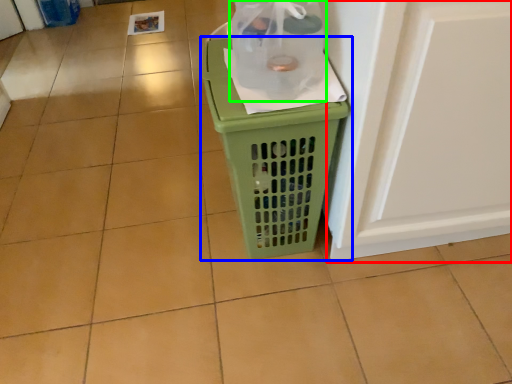
Question: Which object is the farthest from screen door (highlighted by a red box)? Choose among these: waste container (highlighted by a blue box) or bottle (highlighted by a green box).

Choices:
 (A) waste container
 (B) bottle

Answer: (B)